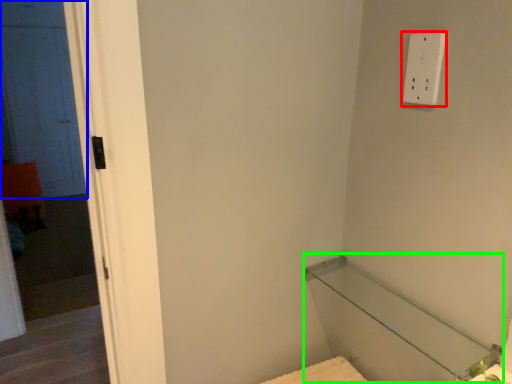
Question: Which object is the closest to the light switch (highlighted by a red box)? Choose among these: door (highlighted by a blue box) or balustrade (highlighted by a green box).

Choices:
 (A) door
 (B) balustrade

Answer: (B)